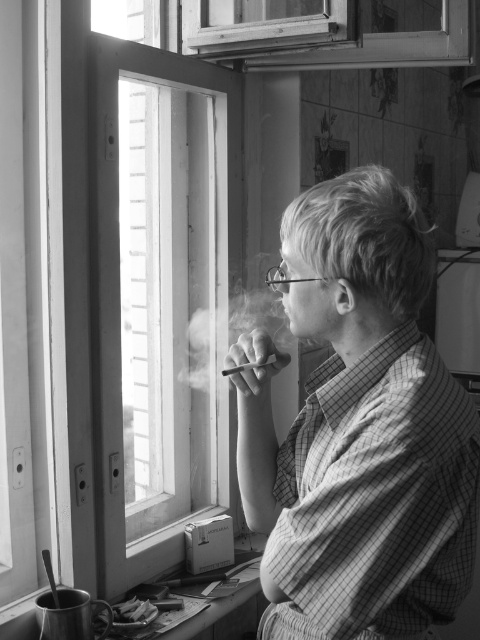
Question: Which object is the closest to the checkered fabric shirt at center?

Choices:
 (A) smooth gray cigarette at center
 (B) smoketransparentsmoke at center

Answer: (A)

Question: Can you confirm if smoketransparentsmoke at center is positioned above smooth gray cigarette at center?

Choices:
 (A) no
 (B) yes

Answer: (B)

Question: Which of the following is the closest to the observer?

Choices:
 (A) (272, 308)
 (B) (332, 621)

Answer: (B)

Question: Which of the following is the closest to the observer?

Choices:
 (A) (420, 557)
 (B) (282, 307)

Answer: (A)

Question: Does checkered fabric shirt at center appear on the left side of smooth gray cigarette at center?

Choices:
 (A) yes
 (B) no

Answer: (B)

Question: Can you confirm if smoketransparentsmoke at center is positioned below smooth gray cigarette at center?

Choices:
 (A) yes
 (B) no

Answer: (B)